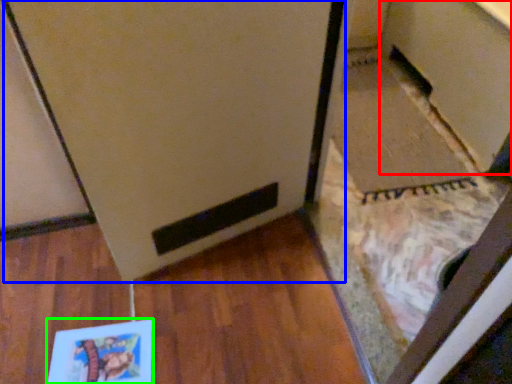
Question: Estimate the real-world distances between objects in this image. Which object is closer to cabinetry (highlighted by a red box), fridge (highlighted by a blue box) or book (highlighted by a green box)?

Choices:
 (A) fridge
 (B) book

Answer: (A)